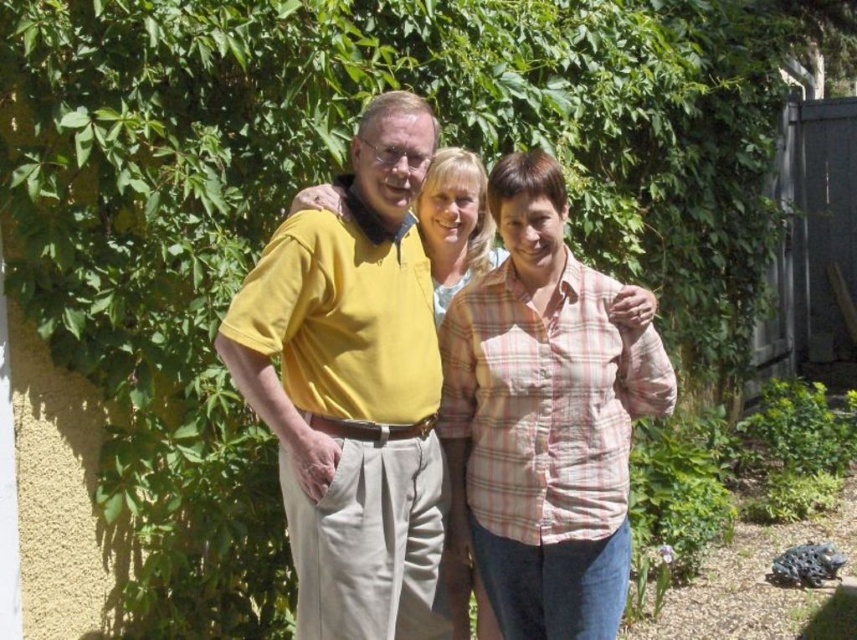
You are a photographer trying to capture a group photo of the yellow cotton shirt at center and the pink plaid shirt at center. Since you want to ensure both subjects are in the frame, which direction should you position the camera relative to the subjects?

The yellow cotton shirt at center is to the left of the pink plaid shirt at center, so you should position the camera to the left side of the subjects to include both in the frame.